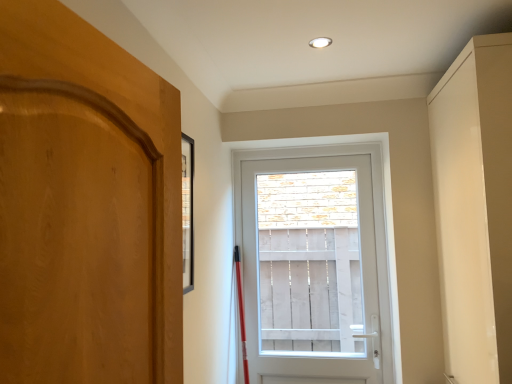
Question: Is matte beige cabinet at right looking in the opposite direction of white plastic door at center?

Choices:
 (A) yes
 (B) no

Answer: (B)

Question: Is matte beige cabinet at right at the right side of white plastic door at center?

Choices:
 (A) no
 (B) yes

Answer: (B)

Question: Could you tell me if matte beige cabinet at right is turned towards white plastic door at center?

Choices:
 (A) yes
 (B) no

Answer: (B)

Question: Is matte beige cabinet at right behind white plastic door at center?

Choices:
 (A) yes
 (B) no

Answer: (B)

Question: From a real-world perspective, is matte beige cabinet at right on white plastic door at center?

Choices:
 (A) yes
 (B) no

Answer: (A)

Question: From a real-world perspective, is matte beige cabinet at right positioned under white plastic door at center based on gravity?

Choices:
 (A) yes
 (B) no

Answer: (B)

Question: From the image's perspective, is white plastic door at center on matte beige cabinet at right?

Choices:
 (A) yes
 (B) no

Answer: (B)

Question: Considering the relative positions of white plastic door at center and matte beige cabinet at right in the image provided, is white plastic door at center to the left of matte beige cabinet at right from the viewer's perspective?

Choices:
 (A) no
 (B) yes

Answer: (B)

Question: From a real-world perspective, is white plastic door at center on matte beige cabinet at right?

Choices:
 (A) yes
 (B) no

Answer: (B)

Question: Is white plastic door at center outside of matte beige cabinet at right?

Choices:
 (A) yes
 (B) no

Answer: (A)

Question: From the image's perspective, does white plastic door at center appear lower than matte beige cabinet at right?

Choices:
 (A) yes
 (B) no

Answer: (A)

Question: Is white plastic door at center surrounding matte beige cabinet at right?

Choices:
 (A) no
 (B) yes

Answer: (A)

Question: Is matte beige cabinet at right bigger or smaller than white plastic door at center?

Choices:
 (A) small
 (B) big

Answer: (B)